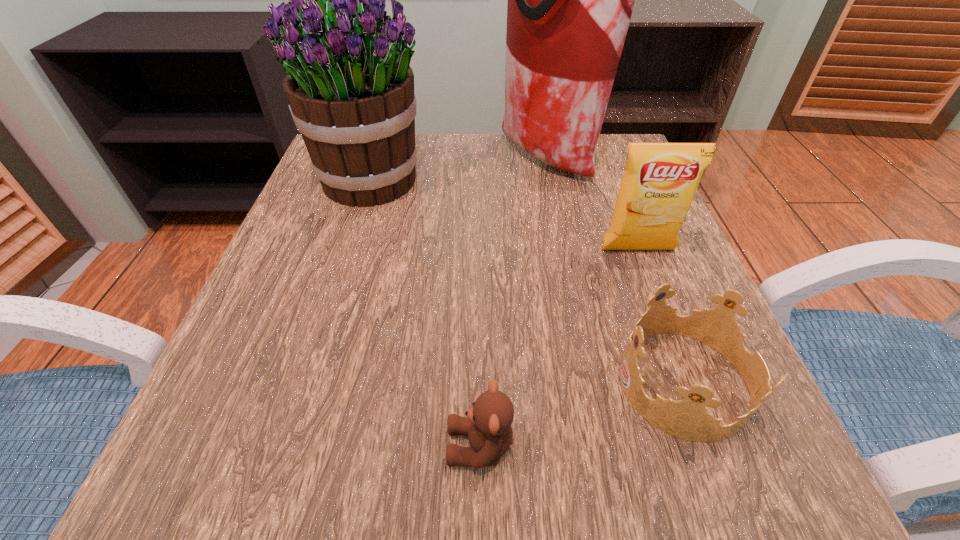
Find the location of a particular element. This screenshot has height=540, width=960. object situated at the left edge is located at coordinates (350, 89).

The width and height of the screenshot is (960, 540). I want to click on grocery bag that is at the right edge, so click(570, 0).

Where is `crisp (potato chip) that is at the right edge`? crisp (potato chip) that is at the right edge is located at coordinates [x=660, y=180].

I want to click on tiara present at the right edge, so tap(687, 419).

Where is `object located at the far left corner`? object located at the far left corner is located at coordinates (350, 89).

Image resolution: width=960 pixels, height=540 pixels. Identify the location of object present at the far right corner. (570, 0).

Locate an element on the screen. Image resolution: width=960 pixels, height=540 pixels. object that is at the near right corner is located at coordinates (687, 419).

Where is `free space at the far edge of the desktop`? free space at the far edge of the desktop is located at coordinates (504, 161).

Where is `vacant space at the left edge`? Image resolution: width=960 pixels, height=540 pixels. vacant space at the left edge is located at coordinates (373, 207).

At what (x,y) coordinates should I click in order to perform the action: click on vacant region at the near left corner of the desktop. Please return your answer as a coordinate pair (x, y). This screenshot has width=960, height=540. Looking at the image, I should click on (277, 443).